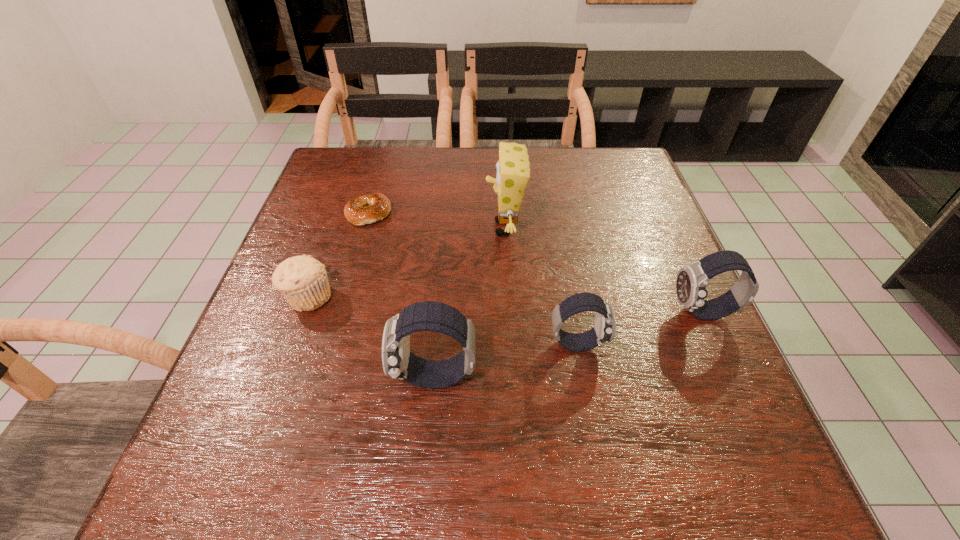
This screenshot has width=960, height=540. What are the coordinates of `free space located 0.160m on the face of the third object from left to right` in the screenshot? It's located at (303, 377).

Locate an element on the screen. The image size is (960, 540). vacant region located on the face of the second watch from left to right is located at coordinates (699, 343).

You are a GUI agent. You are given a task and a screenshot of the screen. Output one action in this format:
    pyautogui.click(x=<x>, y=<y>)
    Task: Click on the blank area located 0.180m on the face of the rightmost watch
    This screenshot has height=540, width=960.
    Given the screenshot: What is the action you would take?
    pyautogui.click(x=583, y=313)

At what (x,y) coordinates should I click in order to perform the action: click on free location located 0.090m on the face of the rightmost watch. Please return your answer as a coordinate pair (x, y). Image resolution: width=960 pixels, height=540 pixels. Looking at the image, I should click on (627, 313).

Locate an element on the screen. Image resolution: width=960 pixels, height=540 pixels. blank area located on the face of the rightmost watch is located at coordinates (588, 313).

In order to click on free spot located on the front of the shortest object in this screenshot , I will do `click(355, 261)`.

At what (x,y) coordinates should I click in order to perform the action: click on free space located on the face of the sponge. Please return your answer as a coordinate pair (x, y). Looking at the image, I should click on (432, 228).

This screenshot has height=540, width=960. In order to click on vacant space located 0.070m on the face of the sponge in this screenshot , I will do `click(456, 228)`.

This screenshot has width=960, height=540. I want to click on free space located 0.320m on the face of the sponge, so click(x=353, y=228).

At what (x,y) coordinates should I click in order to perform the action: click on free region located on the front of the muffin. Please return your answer as a coordinate pair (x, y). The height and width of the screenshot is (540, 960). Looking at the image, I should click on click(x=291, y=345).